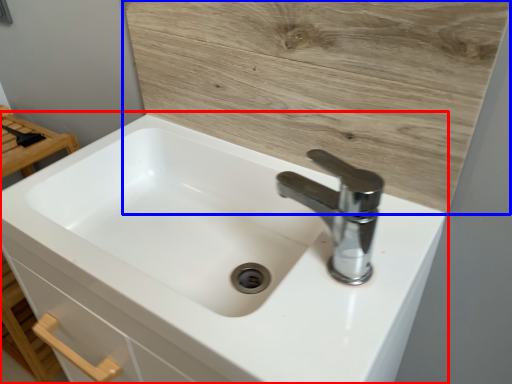
Question: Which point is closer to the camera, sink (highlighted by a red box) or plywood (highlighted by a blue box)?

Choices:
 (A) sink
 (B) plywood

Answer: (A)